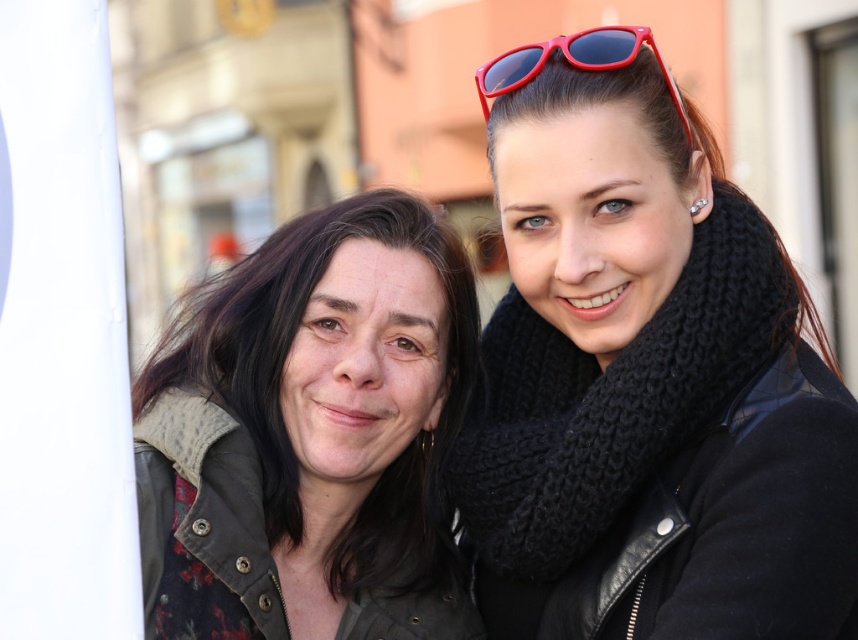
You are a photographer trying to capture a closeup of the dark brown leather jacket at center and the shiny plastic sunglasses at upper right. Which object should you zoom in on first to ensure it fills the frame without moving the camera?

The dark brown leather jacket at center is taller than the shiny plastic sunglasses at upper right, so you should zoom in on the dark brown leather jacket at center first to ensure it fills the frame properly before adjusting for the smaller sunglasses.

You are a photographer adjusting the camera focus. You need to ensure both the dark brown leather jacket at center and the black knitted scarf at upper right are in focus. Given their sizes, which object should you prioritize focusing on first to ensure depth of field captures both?

The dark brown leather jacket at center should be prioritized for focusing first since it has a larger size compared to the black knitted scarf at upper right, allowing the depth of field to encompass both objects effectively.

You are a photographer trying to focus on the dark brown leather jacket at center in the image. You notice a point marked at coordinates (310, 435). Is this point likely part of the dark brown leather jacket at center?

Yes, the point at coordinates (310, 435) corresponds to the dark brown leather jacket at center, so it is part of that object.